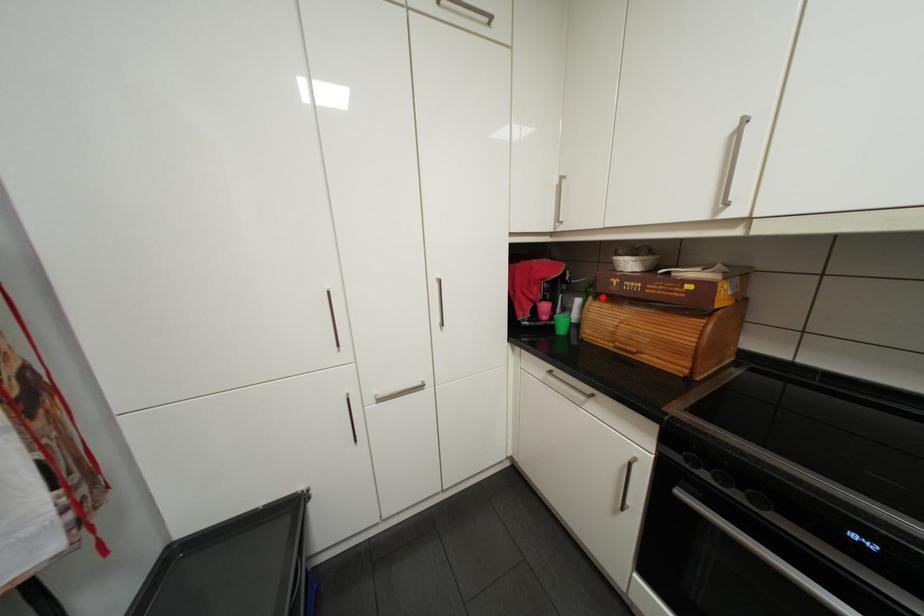
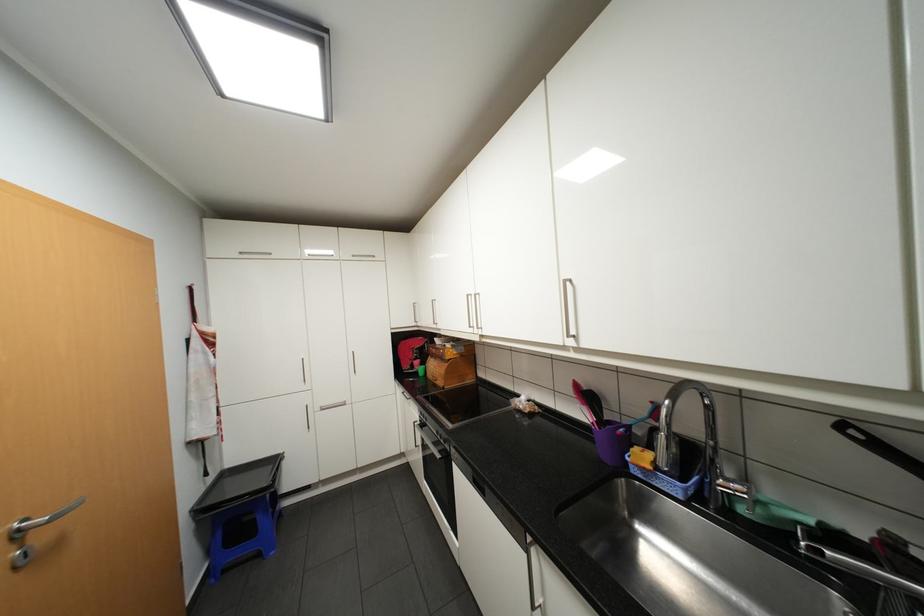
Question: A red point is marked in image1. In image2, is the corresponding 3D point closer to the camera or farther? Reply with the corresponding letter.

Choices:
 (A) The corresponding 3D point is closer.
 (B) The corresponding 3D point is farther.

Answer: (B)